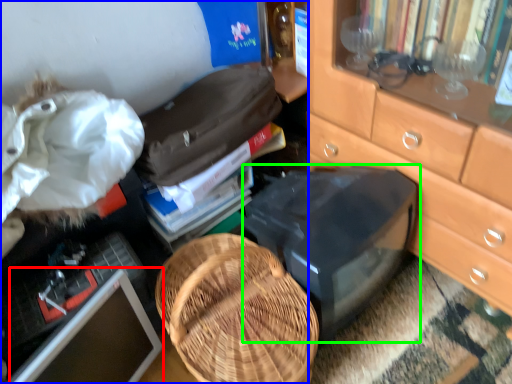
Question: Which is nearer to the computer monitor (highlighted by a red box)? desk (highlighted by a blue box) or desktop (highlighted by a green box).

Choices:
 (A) desk
 (B) desktop

Answer: (A)